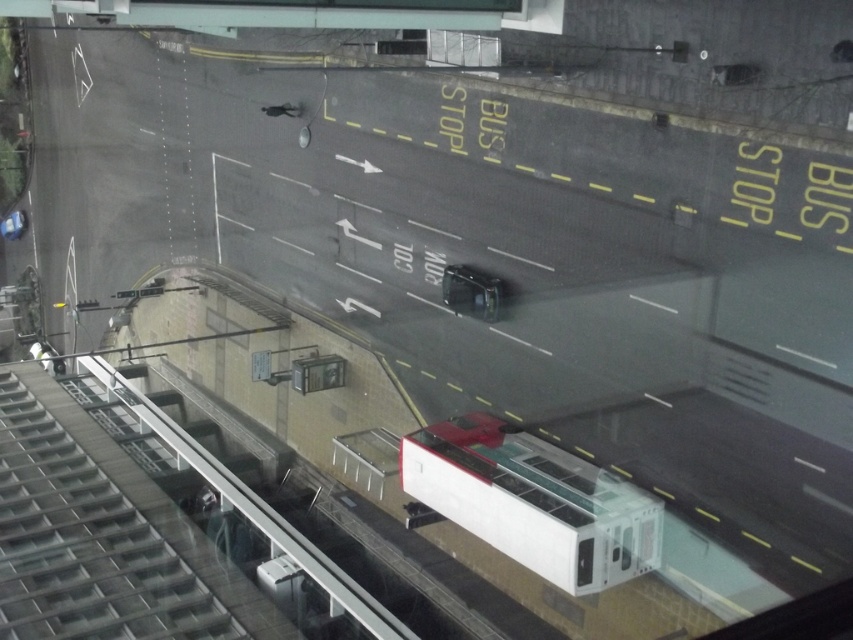
Does white plastic train at center appear under shiny silver car at center?

Correct, white plastic train at center is located below shiny silver car at center.

Is white plastic train at center bigger than shiny silver car at center?

Correct, white plastic train at center is larger in size than shiny silver car at center.

Describe the element at coordinates (532, 500) in the screenshot. I see `white plastic train at center` at that location.

Where is `white plastic train at center`? The width and height of the screenshot is (853, 640). white plastic train at center is located at coordinates (532, 500).